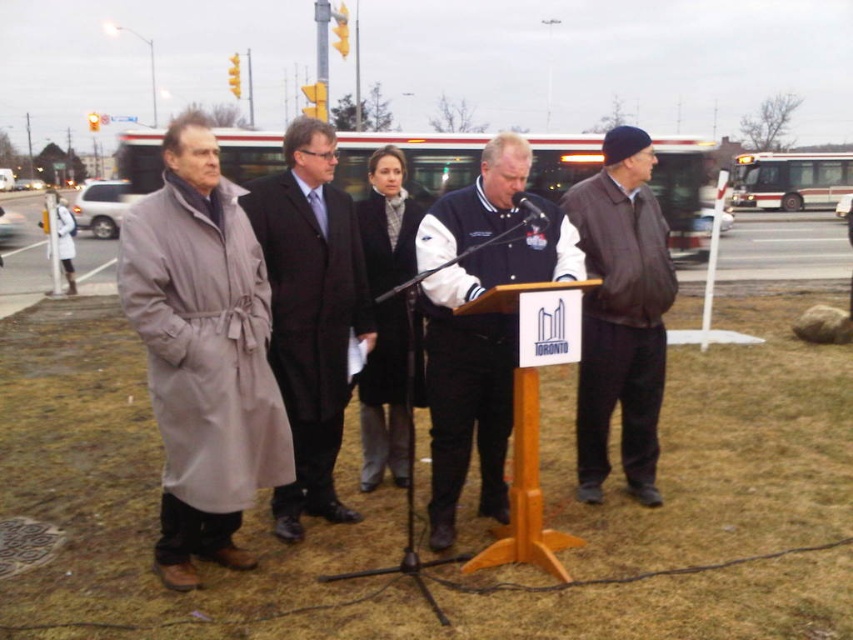
Is dark brown wool coat at center below brown leather jacket at right?

Yes, dark brown wool coat at center is below brown leather jacket at right.

Is dark brown wool coat at center in front of brown leather jacket at right?

Yes, it is.

Is point (297, 186) positioned after point (584, 404)?

No.

The width and height of the screenshot is (853, 640). Identify the location of dark brown wool coat at center. (310, 314).

Who is positioned more to the right, dark brown wool coat at center or black plastic microphone at center?

black plastic microphone at center

Is point (305, 499) farther from viewer compared to point (532, 220)?

Yes, it is behind point (532, 220).

Locate an element on the screen. Image resolution: width=853 pixels, height=640 pixels. dark brown wool coat at center is located at coordinates (310, 314).

Is varsity jacket at center shorter than brown leather jacket at right?

Correct, varsity jacket at center is not as tall as brown leather jacket at right.

Can you confirm if varsity jacket at center is wider than brown leather jacket at right?

Yes.

Is point (498, 458) closer to camera compared to point (607, 349)?

Yes.

I want to click on varsity jacket at center, so click(x=480, y=364).